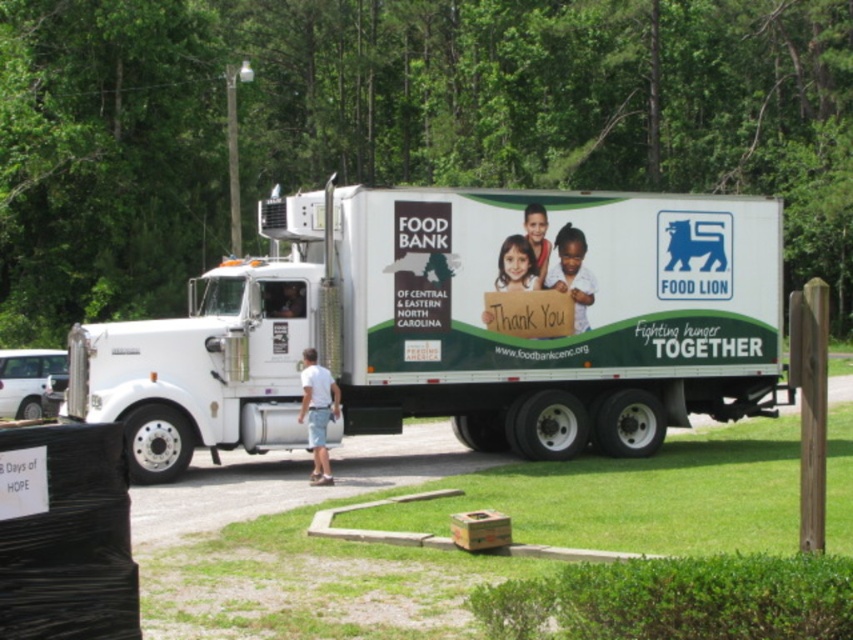
You are a delivery driver who needs to park your white matte truck at center in a parking lot that has a 6 meter width. Will your truck fit in the parking space?

The white matte truck at center is 6.50 meters in length, which is longer than the 6 meter width of the parking space. Therefore, the truck will not fit within the parking space.

You are a photographer trying to capture a wide shot of the white matte truck at center and the black plastic sign at lower left. Given that your camera can only focus on objects within a 3 meter width, will both objects fit in the frame?

The white matte truck at center is wider than the black plastic sign at lower left. Since the camera can focus on objects within a 3 meter width, but the truck is wider than the sign, it depends on their combined width. However, the description only states the truck is larger in width than the sign, not their exact measurements. Without knowing the exact widths, we cannot confirm if both will fit.